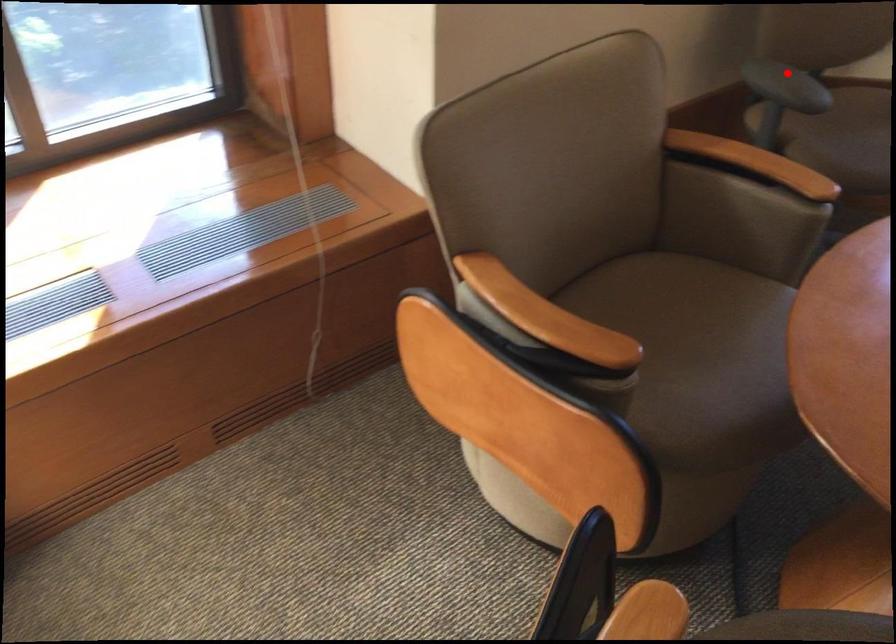
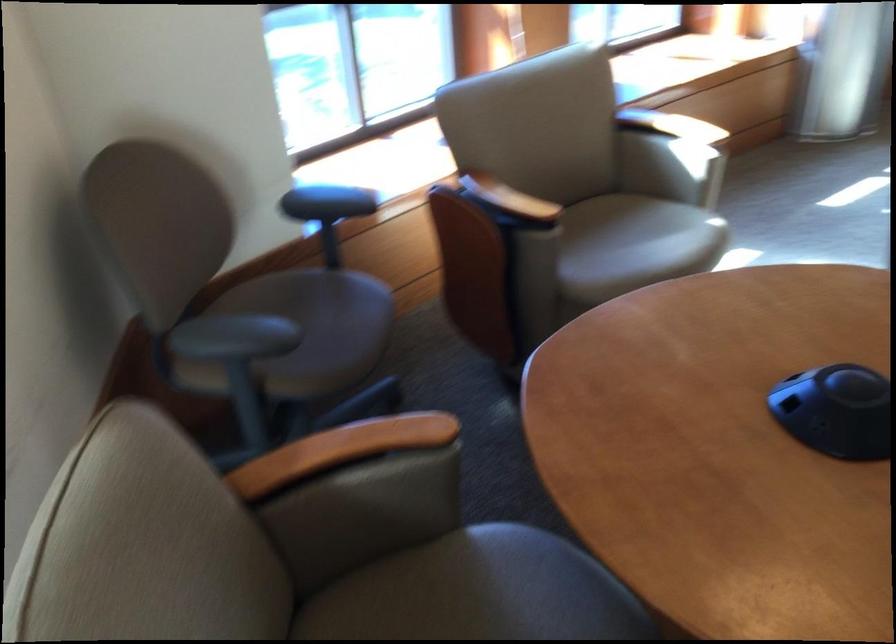
Question: A red point is marked in image1. In image2, is the corresponding 3D point closer to the camera or farther? Reply with the corresponding letter.

Choices:
 (A) The corresponding 3D point is closer.
 (B) The corresponding 3D point is farther.

Answer: (A)